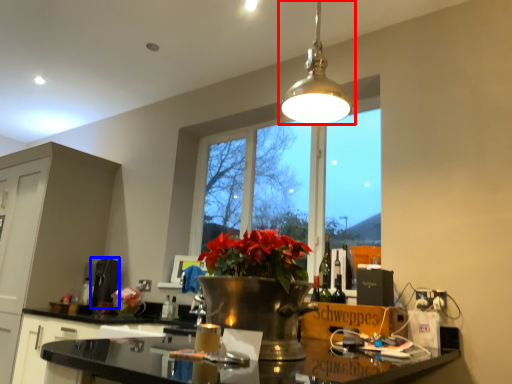
Question: Which of the following is the closest to the observer, lamp (highlighted by a red box) or appliance (highlighted by a blue box)?

Choices:
 (A) lamp
 (B) appliance

Answer: (A)